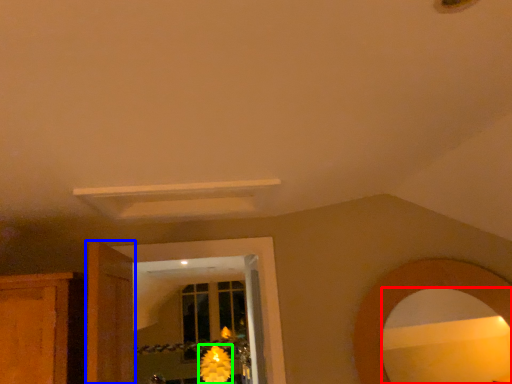
Question: Estimate the real-world distances between objects in this image. Which object is closer to mirror (highlighted by a red box), door (highlighted by a blue box) or flower (highlighted by a green box)?

Choices:
 (A) door
 (B) flower

Answer: (A)